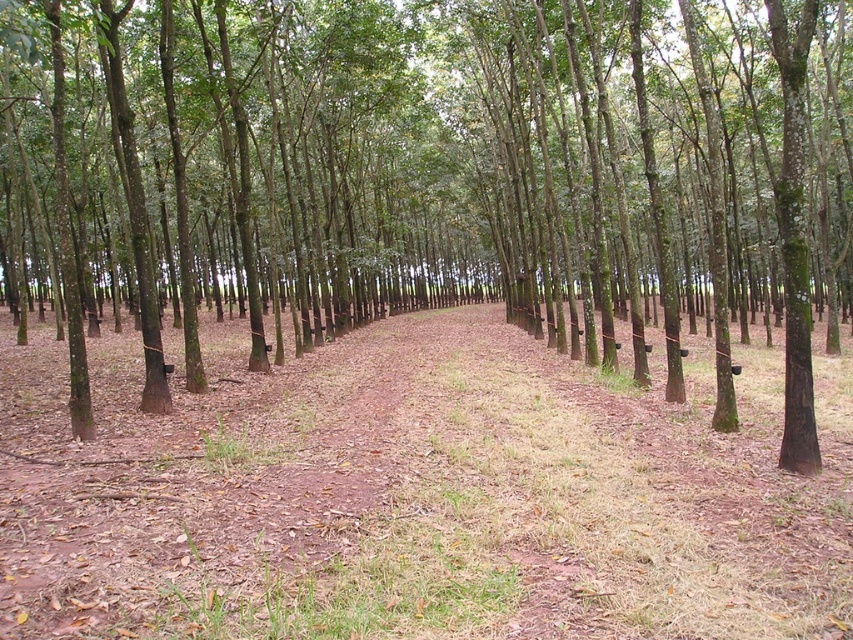
You are walking along the brown dirt trail at center in a rubber plantation. You notice a brown smooth tree at center. Which one is closer to you, the tree or the trail?

The brown smooth tree at center is closer to you than the brown dirt trail at center because it is positioned further to the viewer, meaning it is in front of the trail.

You are a hiker walking along the brown dirt trail at center in a rubber plantation. You notice a brown smooth tree at center. Which one is bigger in size?

The brown smooth tree at center is larger in size compared to the brown dirt trail at center.

In the scene shown: You are a farmer who needs to place a 4 meter long fence between two brown smooth tree at center. Will the fence fit perfectly between them?

The distance between the two brown smooth tree at center is 4.19 meters, which is slightly longer than the 4 meter fence. Therefore, the fence will fit with a small gap remaining between them.